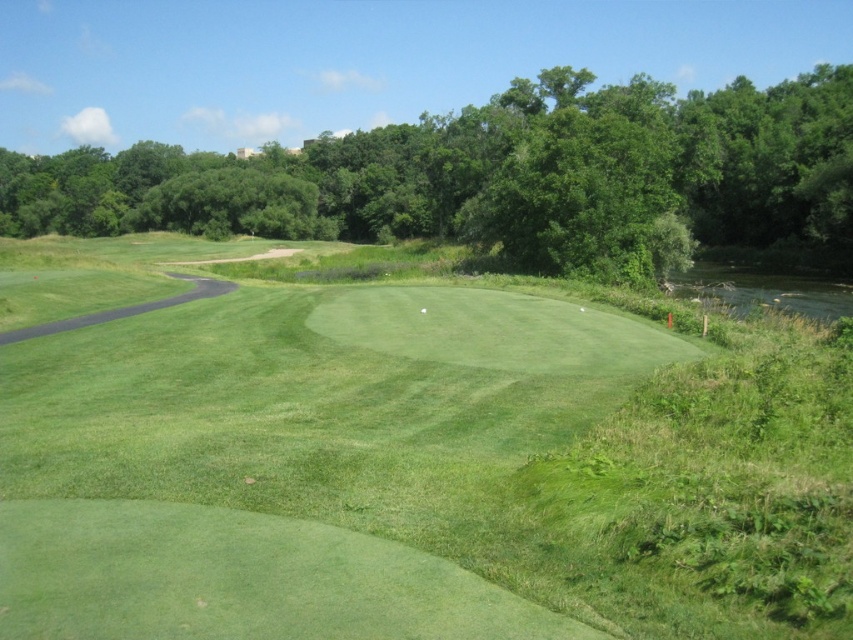
Which is behind, point (225, 596) or point (167, 204)?

The point (167, 204) is more distant.

Is green grassy golf course at center in front of green leafy tree at upper center?

Yes, it is in front of green leafy tree at upper center.

Is point (508, 406) positioned after point (706, 232)?

No, (508, 406) is in front of (706, 232).

At what (x,y) coordinates should I click in order to perform the action: click on green grassy golf course at center. Please return your answer as a coordinate pair (x, y). Looking at the image, I should click on (293, 461).